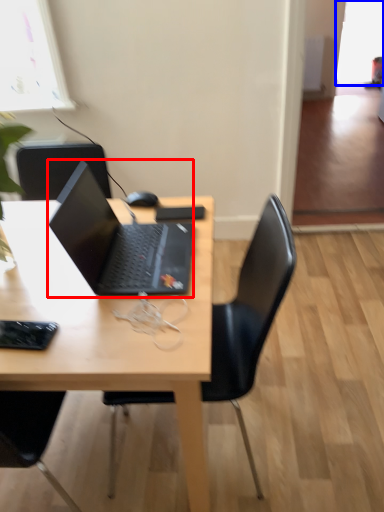
Question: Which object is closer to the camera taking this photo, laptop (highlighted by a red box) or window screen (highlighted by a blue box)?

Choices:
 (A) laptop
 (B) window screen

Answer: (A)